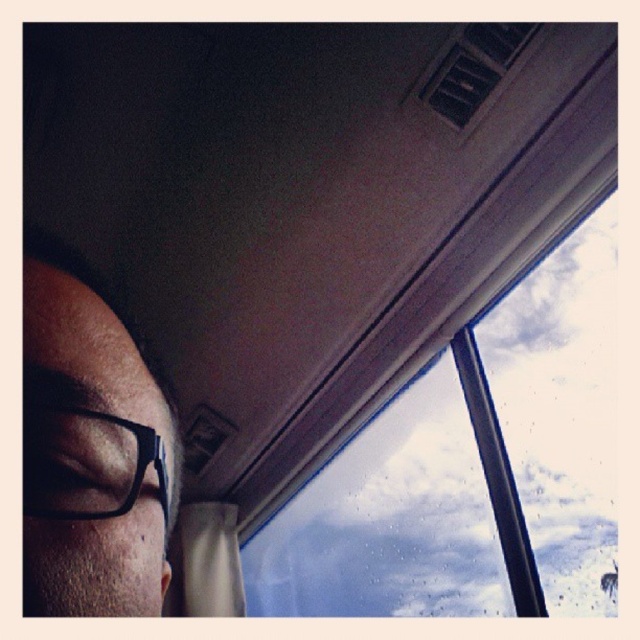
Is transparent glass window at upper right taller than matte black glasses at left?

Indeed, transparent glass window at upper right has a greater height compared to matte black glasses at left.

How far apart are transparent glass window at upper right and matte black glasses at left?

A distance of 1.68 meters exists between transparent glass window at upper right and matte black glasses at left.

Locate an element on the screen. transparent glass window at upper right is located at coordinates coord(472,468).

Is point (58, 563) positioned after point (125, 508)?

No.

How far apart are matte black glasses at left and black plastic glasses at lower left?

A distance of 1.62 inches exists between matte black glasses at left and black plastic glasses at lower left.

This screenshot has height=640, width=640. What are the coordinates of `matte black glasses at left` in the screenshot? It's located at (115, 417).

Is transparent glass window at upper right positioned behind black plastic glasses at lower left?

Yes, it is behind black plastic glasses at lower left.

Is point (259, 580) farther from viewer compared to point (76, 483)?

Yes.

Is point (396, 429) farther from camera compared to point (134, 436)?

Yes, point (396, 429) is farther from viewer.

The height and width of the screenshot is (640, 640). What are the coordinates of `transparent glass window at upper right` in the screenshot? It's located at (472, 468).